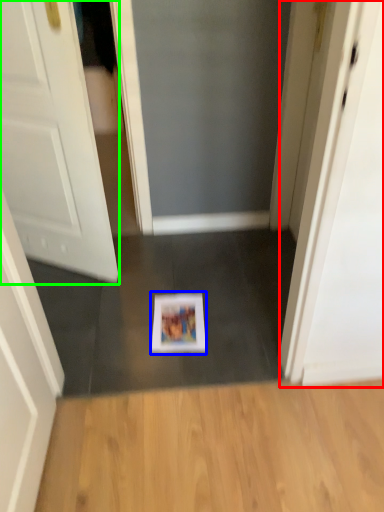
Question: Considering the real-world distances, which object is farthest from screen door (highlighted by a red box)? magazine (highlighted by a blue box) or door (highlighted by a green box)?

Choices:
 (A) magazine
 (B) door

Answer: (B)